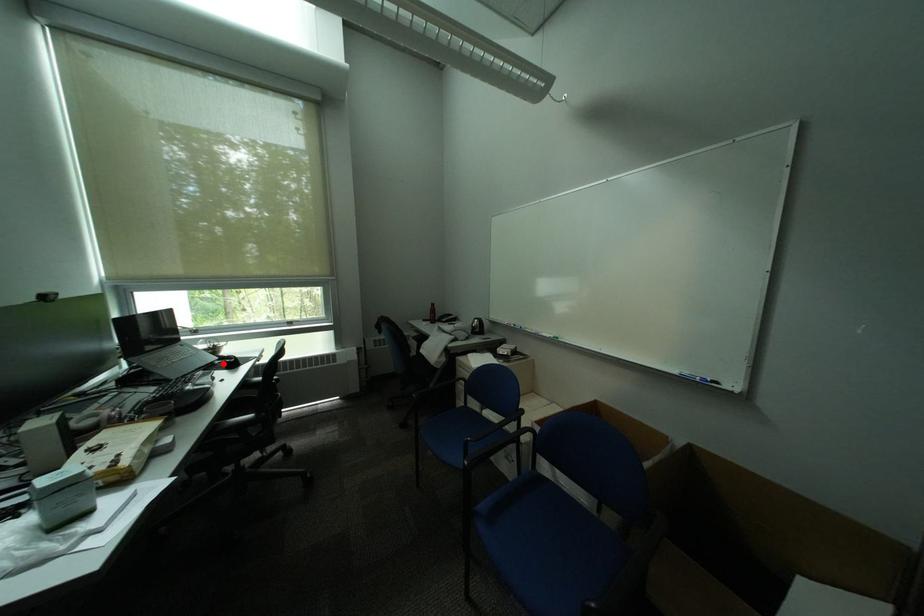
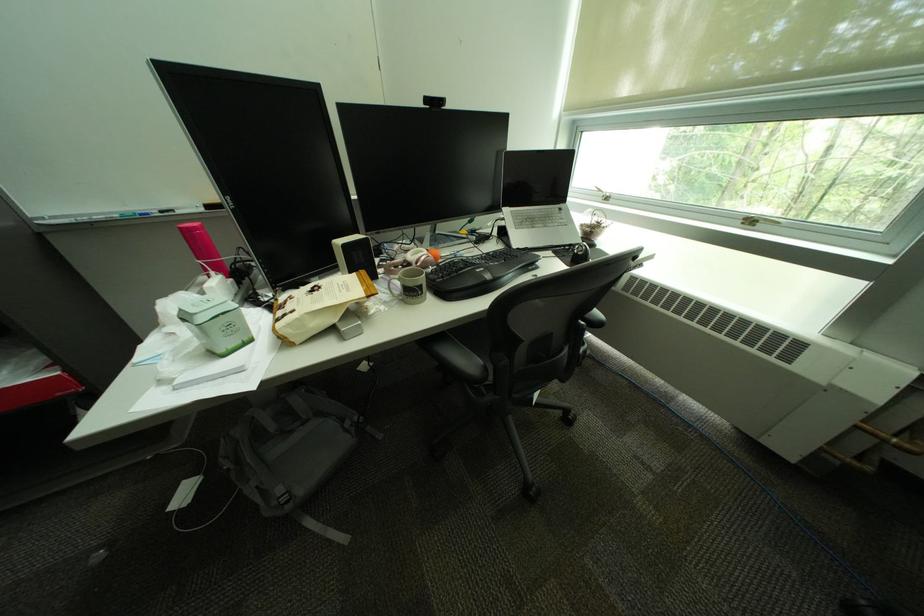
Find the pixel in the second image that matches the highlighted location in the first image.

(580, 246)